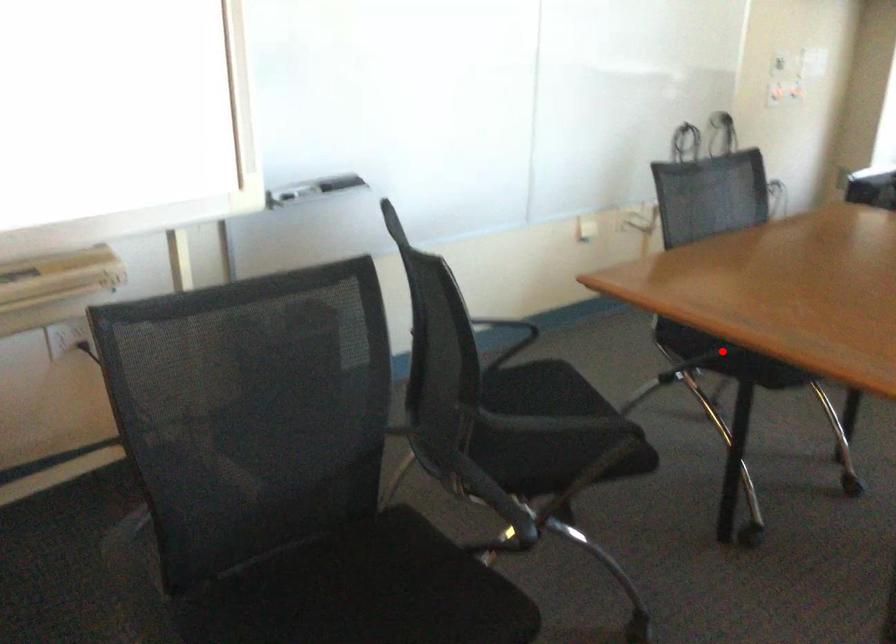
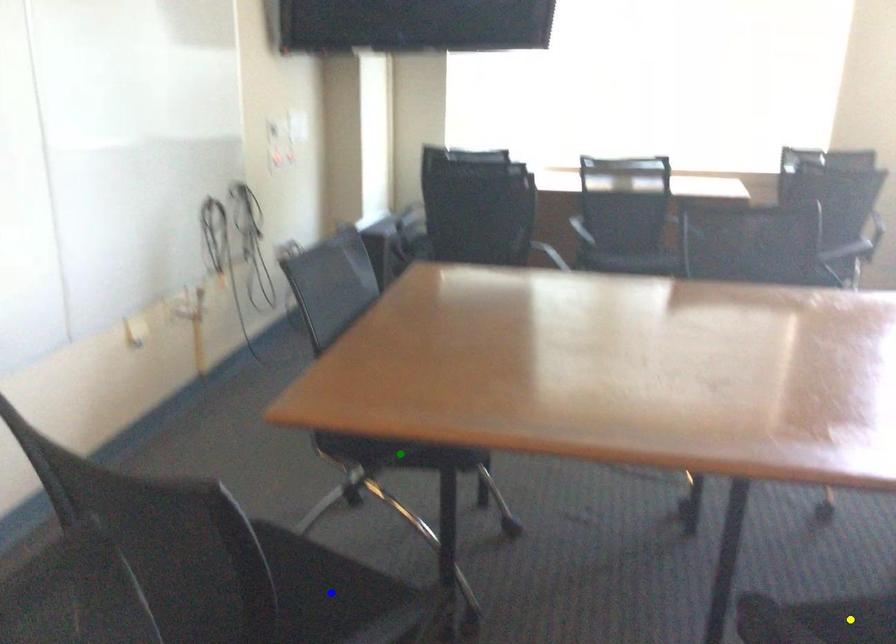
Question: I am providing you with two images of the same scene from different viewpoints. A red point is marked on the first image. You are given multiple points on the second image. Which spot in image 2 lines up with the point in image 1?

Choices:
 (A) blue point
 (B) green point
 (C) yellow point

Answer: (B)